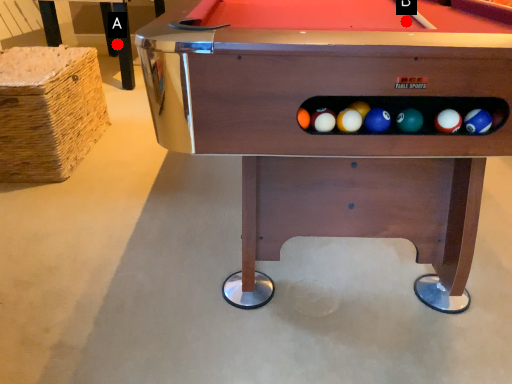
Question: Two points are circled on the image, labeled by A and B beside each circle. Which point is further to the camera?

Choices:
 (A) A is further
 (B) B is further

Answer: (A)